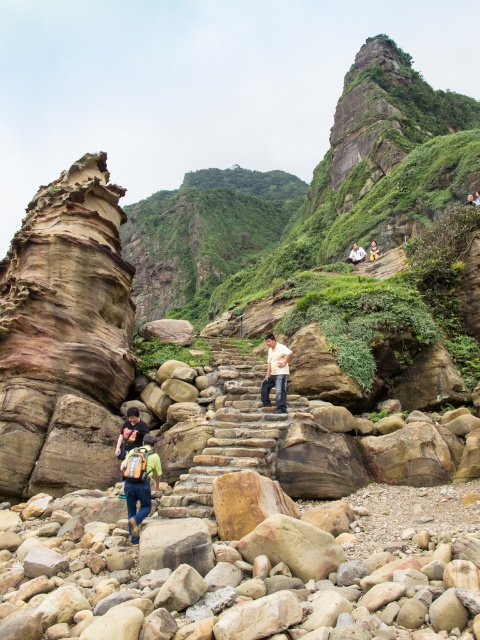
From the picture: Can you confirm if green fabric backpack at lower left is taller than light brown wooden bench at upper center?

Yes.

Which is below, green fabric backpack at lower left or light brown wooden bench at upper center?

green fabric backpack at lower left is lower down.

In order to click on green fabric backpack at lower left in this screenshot , I will do `click(141, 483)`.

From the picture: Is green fabric backpack at lower left closer to camera compared to light brown leather jacket at center?

Yes, green fabric backpack at lower left is in front of light brown leather jacket at center.

The height and width of the screenshot is (640, 480). What are the coordinates of `green fabric backpack at lower left` in the screenshot? It's located at (141, 483).

In order to click on green fabric backpack at lower left in this screenshot , I will do `click(141, 483)`.

Between white cotton shirt at center and light brown leather jacket at center, which one appears on the left side from the viewer's perspective?

Positioned to the left is white cotton shirt at center.

Does point (280, 388) come farther from viewer compared to point (351, 257)?

No, (280, 388) is in front of (351, 257).

Between point (277, 400) and point (363, 250), which one is positioned behind?

The point (363, 250) is more distant.

I want to click on white cotton shirt at center, so click(x=276, y=372).